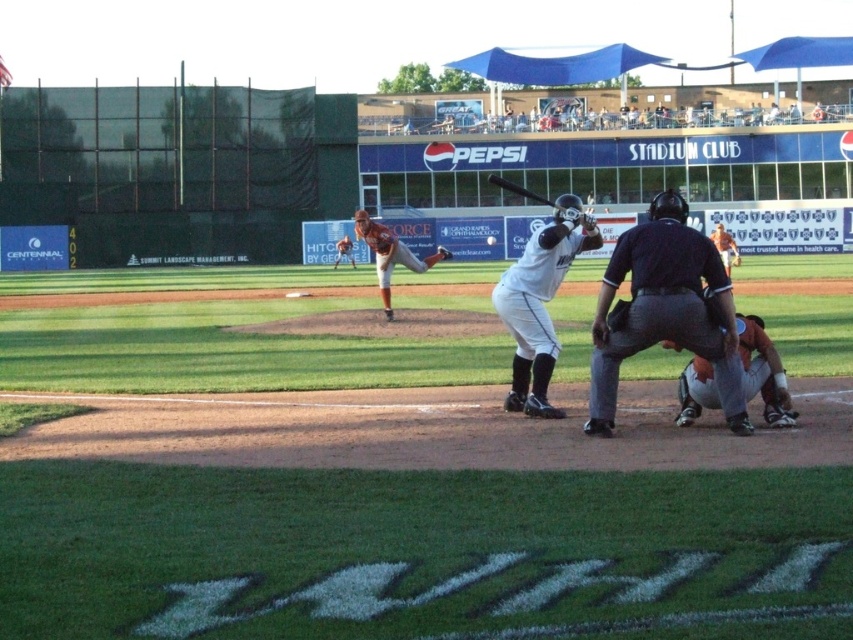
Where is `black matte bat at center`? The height and width of the screenshot is (640, 853). black matte bat at center is located at coordinates (549, 202).

Is the position of black matte bat at center less distant than that of white matte baseball at center?

That is True.

Which is behind, point (514, 189) or point (495, 243)?

Positioned behind is point (495, 243).

Where is `black matte bat at center`? This screenshot has width=853, height=640. black matte bat at center is located at coordinates (549, 202).

Is white matte baseball bat at center bigger than black matte bat at center?

Incorrect, white matte baseball bat at center is not larger than black matte bat at center.

Who is more forward, (521, 337) or (546, 202)?

Point (546, 202)

Does point (572, 202) come in front of point (538, 200)?

Yes, it is in front of point (538, 200).

Locate an element on the screen. white matte baseball bat at center is located at coordinates pyautogui.click(x=538, y=301).

Measure the distance between white matte baseball bat at center and orange jersey at center.

white matte baseball bat at center and orange jersey at center are 14.64 meters apart.

Is white matte baseball bat at center thinner than orange jersey at center?

Yes, white matte baseball bat at center is thinner than orange jersey at center.

Measure the distance between point [514,392] and camera.

Point [514,392] and camera are 10.51 meters apart from each other.

Image resolution: width=853 pixels, height=640 pixels. What are the coordinates of `white matte baseball bat at center` in the screenshot? It's located at [x=538, y=301].